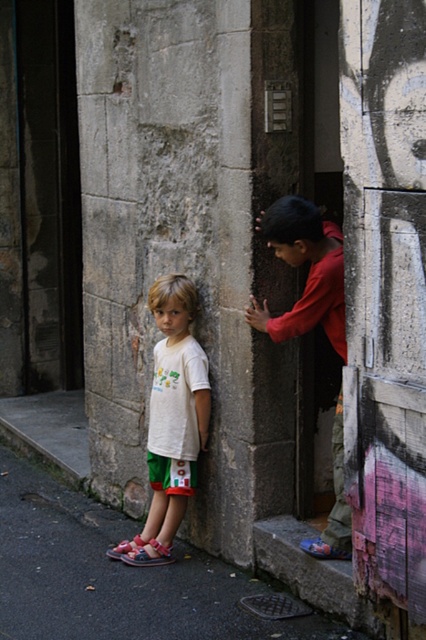
You are a drone operator trying to deliver a small package to a point in front of the child on the right. The coordinates of the two points are point (423, 595) and point (322, 248). Which coordinate should you choose to ensure the package lands in front of the child on the right?

Point (423, 595) is in front of point (322, 248), so you should choose point (423, 595) to ensure the package lands in front of the child on the right.